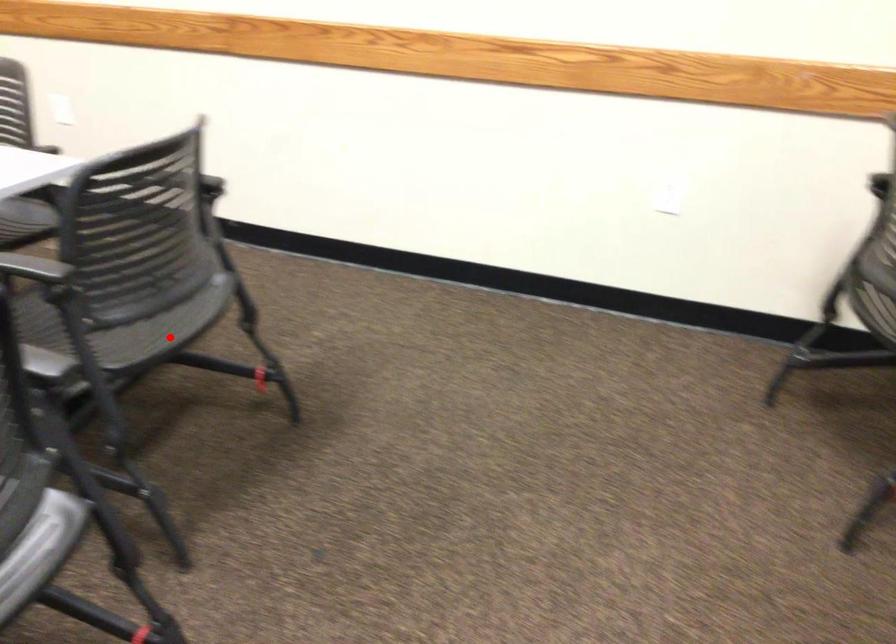
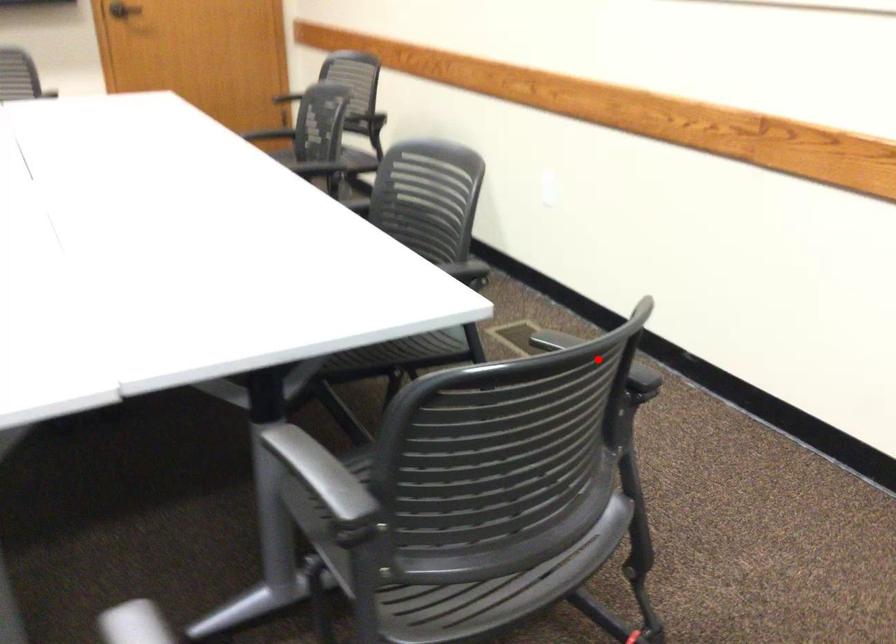
I am providing you with two images of the same scene from different viewpoints. A red point is marked on the first image and another point is marked on the second image. Does the point marked in image1 correspond to the same location as the one in image2?

No